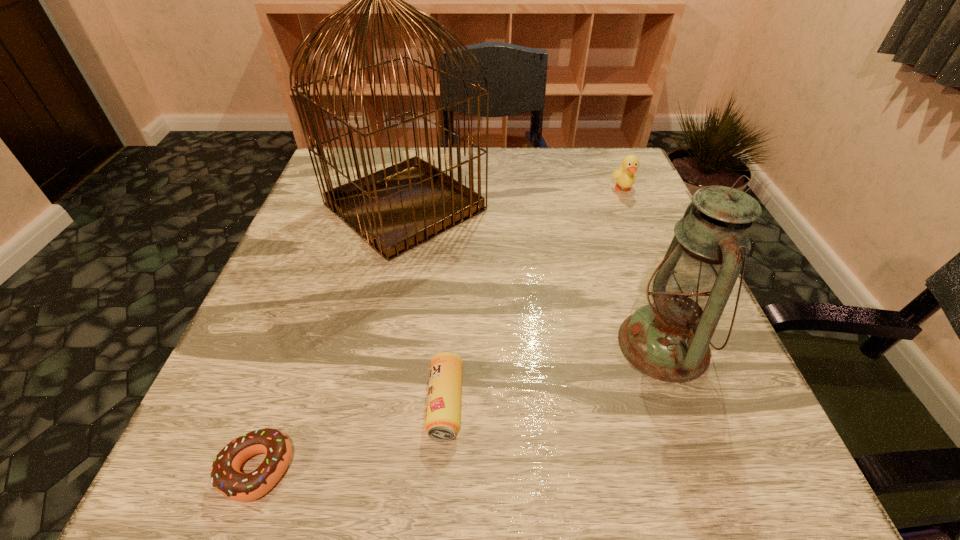
You are a GUI agent. You are given a task and a screenshot of the screen. Output one action in this format:
    pyautogui.click(x=<x>, y=<y>)
    Task: Click on the object that is at the far right corner
    
    Given the screenshot: What is the action you would take?
    pyautogui.click(x=625, y=176)

Identify the location of free space at the far edge of the desktop. click(x=510, y=148).

In the image, there is a desktop. Identify the location of vacant space at the near edge. Image resolution: width=960 pixels, height=540 pixels. (516, 455).

Locate an element on the screen. The image size is (960, 540). vacant space at the left edge of the desktop is located at coordinates (343, 328).

Where is `free region at the right edge of the desktop`? This screenshot has width=960, height=540. free region at the right edge of the desktop is located at coordinates (592, 231).

In the image, there is a desktop. Where is `blank space at the far left corner`? This screenshot has width=960, height=540. blank space at the far left corner is located at coordinates (368, 159).

Find the location of `vacant space at the far right corner`. vacant space at the far right corner is located at coordinates (642, 185).

This screenshot has width=960, height=540. I want to click on free space between the beer can and the oil lamp, so click(x=554, y=374).

Where is `free space between the third tallest object and the oil lamp`? The height and width of the screenshot is (540, 960). free space between the third tallest object and the oil lamp is located at coordinates (643, 267).

Image resolution: width=960 pixels, height=540 pixels. Identify the location of empty space that is in between the tallest object and the beer can. (425, 305).